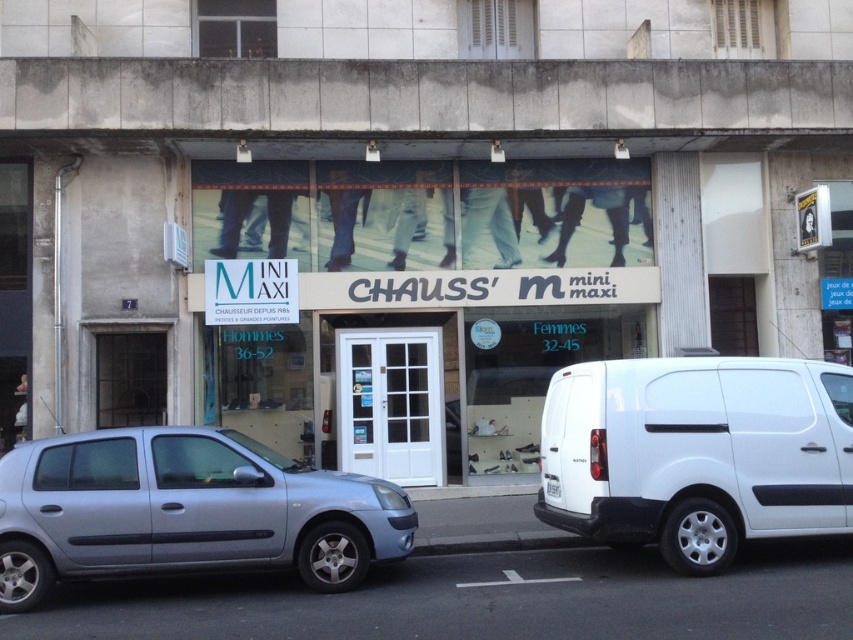
Can you confirm if white matte van at right is wider than satin silver car at lower left?

In fact, white matte van at right might be narrower than satin silver car at lower left.

Between white matte van at right and satin silver car at lower left, which one appears on the left side from the viewer's perspective?

Positioned to the left is satin silver car at lower left.

Locate an element on the screen. The height and width of the screenshot is (640, 853). white matte van at right is located at coordinates (697, 452).